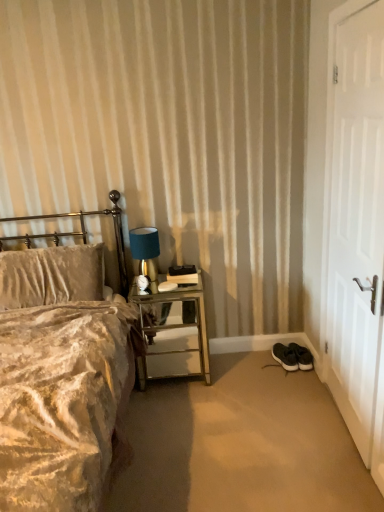
Question: From a real-world perspective, is metallic gold headboard at left positioned above or below satin blue lampshade at upper right?

Choices:
 (A) above
 (B) below

Answer: (B)

Question: Considering the relative positions of metallic gold headboard at left and satin blue lampshade at upper right in the image provided, is metallic gold headboard at left to the left or to the right of satin blue lampshade at upper right?

Choices:
 (A) right
 (B) left

Answer: (B)

Question: Estimate the real-world distances between objects in this image. Which object is farther from the satin blue lampshade at upper right?

Choices:
 (A) black suede sneakers at lower right, marked as the first footwear in a left-to-right arrangement
 (B) black suede sneakers at lower right, placed as the 1th footwear when sorted from right to left
 (C) black fabric shoes at lower right
 (D) white matte door at right
 (E) velvet beige bed at left

Answer: (D)

Question: Estimate the real-world distances between objects in this image. Which object is farther from the metallic gold headboard at left?

Choices:
 (A) black fabric shoes at lower right
 (B) black suede sneakers at lower right, the 2th footwear in the right-to-left sequence
 (C) white matte door at right
 (D) black suede sneakers at lower right, placed as the 1th footwear when sorted from right to left
 (E) velvet beige bed at left

Answer: (C)